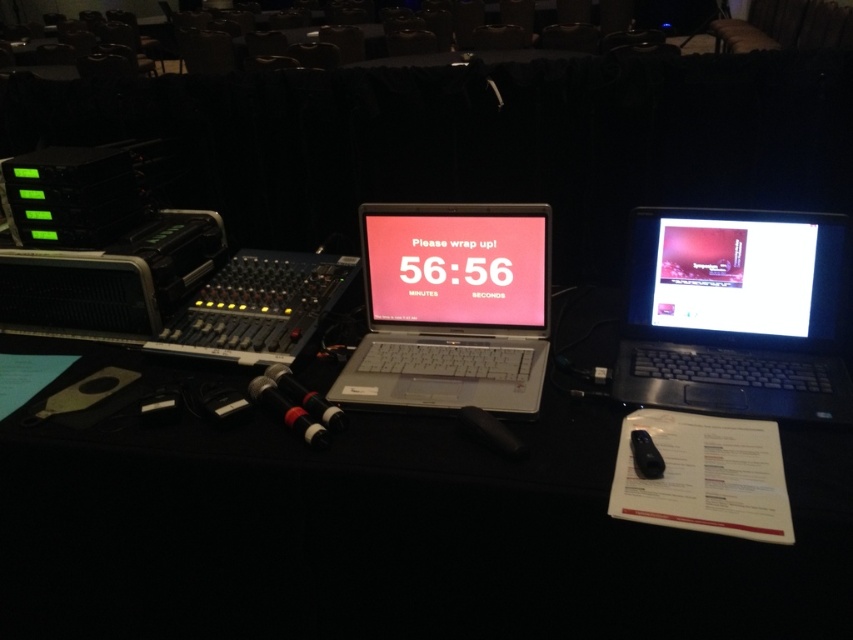
Question: Which point is closer to the camera taking this photo?

Choices:
 (A) (418, 304)
 (B) (747, 285)
 (C) (752, 333)
 (D) (453, 227)

Answer: (B)

Question: Which point is closer to the camera?

Choices:
 (A) (430, 214)
 (B) (746, 316)
 (C) (479, 308)
 (D) (715, 216)

Answer: (D)

Question: Is black plastic laptop at right closer to camera compared to silver metallic laptop at center?

Choices:
 (A) no
 (B) yes

Answer: (B)

Question: Is pink glossy screen at center thinner than matte black monitor at right?

Choices:
 (A) yes
 (B) no

Answer: (B)

Question: Is black plastic laptop at right thinner than pink glossy screen at center?

Choices:
 (A) no
 (B) yes

Answer: (A)

Question: Estimate the real-world distances between objects in this image. Which object is closer to the pink glossy screen at center?

Choices:
 (A) matte black monitor at right
 (B) silver metallic laptop at center

Answer: (B)